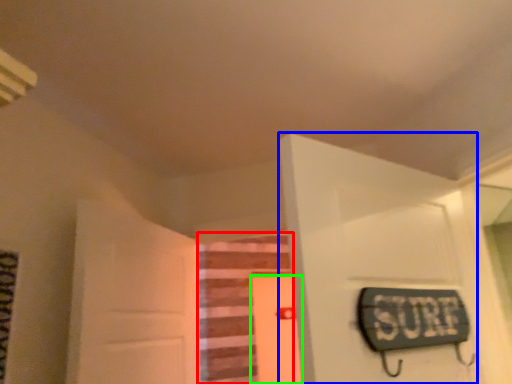
Question: Estimate the real-world distances between objects in this image. Which object is closer to stairwell (highlighted by a red box), door (highlighted by a blue box) or door (highlighted by a green box)?

Choices:
 (A) door
 (B) door

Answer: (B)